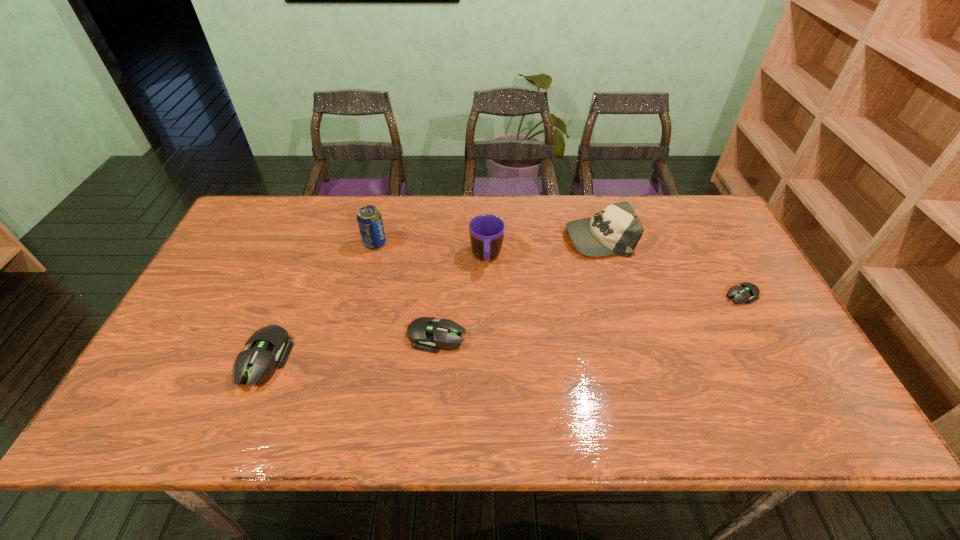
The width and height of the screenshot is (960, 540). Find the location of `object at the near edge`. object at the near edge is located at coordinates (255, 366).

Identify the location of object that is at the right edge. (745, 292).

The width and height of the screenshot is (960, 540). I want to click on vacant space at the far edge of the desktop, so click(x=531, y=217).

Where is `free spot at the left edge of the desktop`? free spot at the left edge of the desktop is located at coordinates click(x=231, y=254).

In the image, there is a desktop. At what (x,y) coordinates should I click in order to perform the action: click on vacant area at the right edge. Please return your answer as a coordinate pair (x, y). Looking at the image, I should click on (701, 248).

In order to click on free space at the far left corner of the desktop in this screenshot , I will do `click(252, 225)`.

Where is `vacant space at the near left corner`? This screenshot has width=960, height=540. vacant space at the near left corner is located at coordinates (200, 379).

Identify the location of unoccupied area between the second object from left to right and the leftmost computer mouse. coord(320,301).

At what (x,y) coordinates should I click in order to perform the action: click on vacant area between the rightmost computer mouse and the fourth object from left to right. Please return your answer as a coordinate pair (x, y). This screenshot has height=540, width=960. Looking at the image, I should click on (613, 276).

Locate an element on the screen. The height and width of the screenshot is (540, 960). vacant space that's between the mug and the second shortest object is located at coordinates (462, 297).